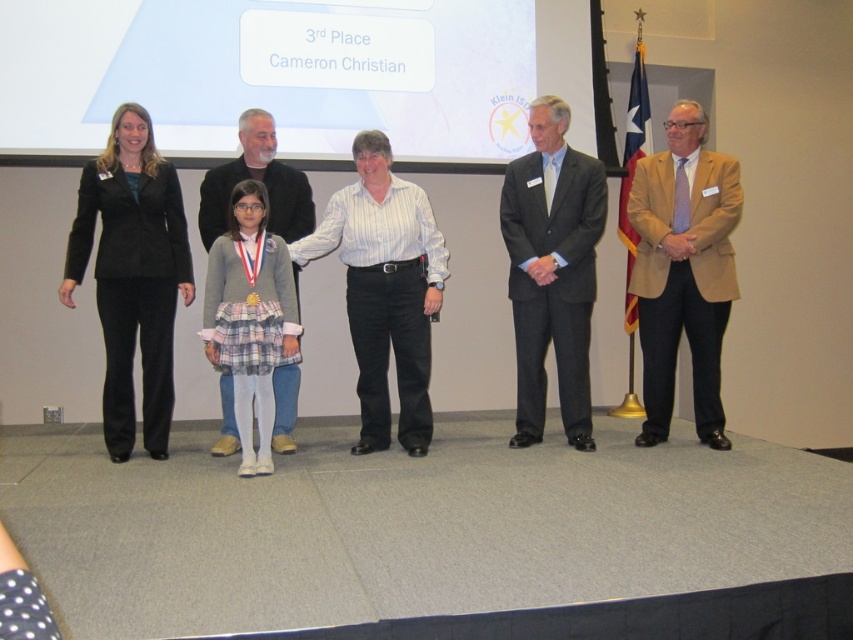
Question: Is white striped shirt at center wider than black wool sweater at center?

Choices:
 (A) yes
 (B) no

Answer: (A)

Question: Which point is closer to the camera taking this photo?

Choices:
 (A) (109, 212)
 (B) (722, 170)
 (C) (374, 362)
 (D) (579, 256)

Answer: (A)

Question: Estimate the real-world distances between objects in this image. Which object is farther from the black suit at left?

Choices:
 (A) black wool sweater at center
 (B) dark gray suit at center
 (C) tan fabric suit at right

Answer: (C)

Question: Is dark gray suit at center bigger than black wool sweater at center?

Choices:
 (A) no
 (B) yes

Answer: (B)

Question: Which is nearer to the dark gray suit at center?

Choices:
 (A) tan fabric suit at right
 (B) black suit at left
 (C) white striped shirt at center
 (D) black wool sweater at center

Answer: (A)

Question: Does black suit at left appear on the left side of white striped shirt at center?

Choices:
 (A) yes
 (B) no

Answer: (A)